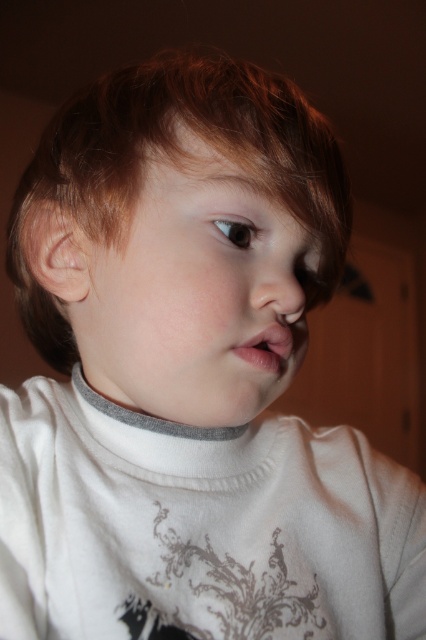
Based on the scene description, which object has a greater width when comparing the smooth skin face at center and the pink glossy lips at center?

The smooth skin face at center has a greater width than the pink glossy lips at center.

You are an artist trying to sketch this child. Where exactly should you place the smooth skin face at center in terms of coordinates?

The smooth skin face at center should be placed at coordinates approximately 0.452 on the x and 0.453 on the y axis.

You are a photographer trying to focus on the child in the image. Since the smooth skin face at center and the pink glossy lips at center are both at the center, which one should you adjust your camera to focus on to ensure the lips are sharp?

The smooth skin face at center is positioned over the pink glossy lips at center, so focusing on the face will naturally include the lips in focus as well.